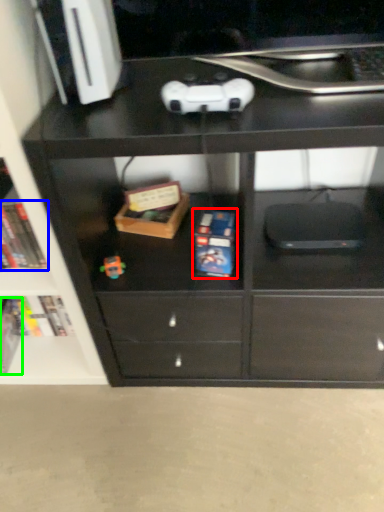
Question: Estimate the real-world distances between objects in this image. Which object is farther from paperback book (highlighted by a red box), book (highlighted by a blue box) or paperback book (highlighted by a green box)?

Choices:
 (A) book
 (B) paperback book

Answer: (B)